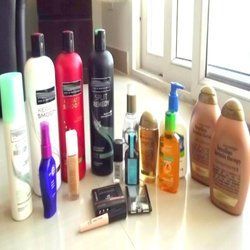
You are a GUI agent. You are given a task and a screenshot of the screen. Output one action in this format:
    pyautogui.click(x=<x>, y=<y>)
    Task: Click on the windows
    This screenshot has height=250, width=250.
    Given the screenshot: What is the action you would take?
    pyautogui.click(x=233, y=40), pyautogui.click(x=189, y=32), pyautogui.click(x=153, y=37)